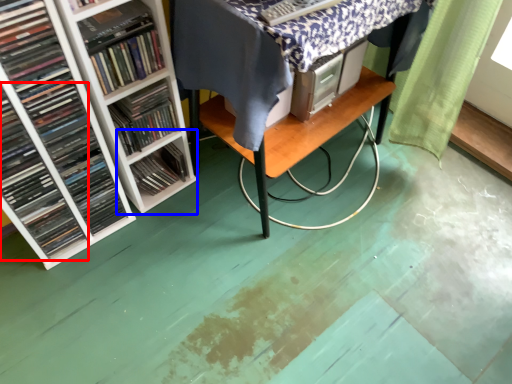
Question: Which point is further to the camera, book (highlighted by a red box) or shelf (highlighted by a blue box)?

Choices:
 (A) book
 (B) shelf

Answer: (B)